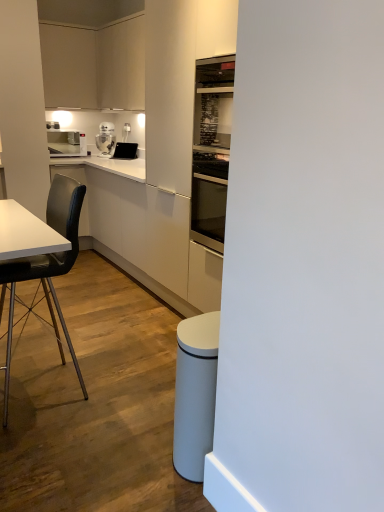
Question: Can we say black matte chair at left lies outside matte black tablet at upper center?

Choices:
 (A) no
 (B) yes

Answer: (B)

Question: From a real-world perspective, is black matte chair at left on matte black tablet at upper center?

Choices:
 (A) no
 (B) yes

Answer: (A)

Question: Is black matte chair at left oriented away from matte black tablet at upper center?

Choices:
 (A) no
 (B) yes

Answer: (A)

Question: Does black matte chair at left lie behind matte black tablet at upper center?

Choices:
 (A) yes
 (B) no

Answer: (B)

Question: From the image's perspective, is black matte chair at left on matte black tablet at upper center?

Choices:
 (A) yes
 (B) no

Answer: (B)

Question: Is matte white cabinet at upper left taller or shorter than black matte chair at left?

Choices:
 (A) short
 (B) tall

Answer: (A)

Question: Considering the positions of point (64, 71) and point (77, 232), is point (64, 71) closer or farther from the camera than point (77, 232)?

Choices:
 (A) farther
 (B) closer

Answer: (A)

Question: Relative to black matte chair at left, is matte white cabinet at upper left in front or behind?

Choices:
 (A) behind
 (B) front

Answer: (A)

Question: Looking at their shapes, would you say matte white cabinet at upper left is wider or thinner than black matte chair at left?

Choices:
 (A) thin
 (B) wide

Answer: (A)

Question: In terms of width, does matte white cabinet at upper left look wider or thinner when compared to white glossy robot at upper center, acting as the first kitchen appliance starting from the right?

Choices:
 (A) thin
 (B) wide

Answer: (B)

Question: Based on their positions, is matte white cabinet at upper left located to the left or right of white glossy robot at upper center, arranged as the 2th kitchen appliance when viewed from the left?

Choices:
 (A) left
 (B) right

Answer: (A)

Question: Considering their positions, is matte white cabinet at upper left located in front of or behind white glossy robot at upper center, arranged as the 2th kitchen appliance when viewed from the left?

Choices:
 (A) front
 (B) behind

Answer: (A)

Question: Which is correct: matte white cabinet at upper left is inside white glossy robot at upper center, acting as the first kitchen appliance starting from the right, or outside of it?

Choices:
 (A) inside
 (B) outside

Answer: (B)

Question: Would you say white glossy robot at upper center, acting as the first kitchen appliance starting from the right, is to the left or to the right of white glossy counter at center in the picture?

Choices:
 (A) left
 (B) right

Answer: (A)

Question: Considering the positions of point (112, 128) and point (122, 257), is point (112, 128) closer or farther from the camera than point (122, 257)?

Choices:
 (A) closer
 (B) farther

Answer: (B)